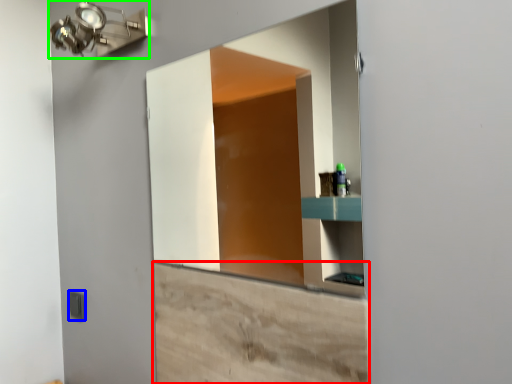
Question: Estimate the real-world distances between objects in this image. Which object is farther from cabinetry (highlighted by a red box), light switch (highlighted by a blue box) or light fixture (highlighted by a green box)?

Choices:
 (A) light switch
 (B) light fixture

Answer: (B)